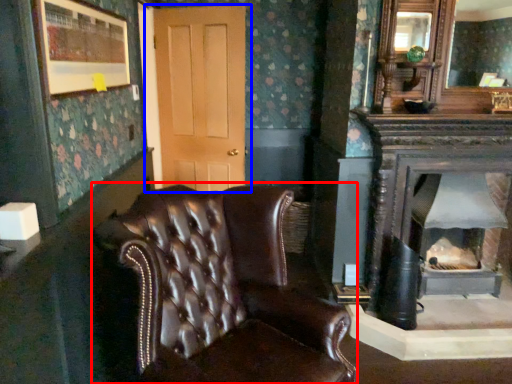
Question: Which object appears closest to the camera in this image, chair (highlighted by a red box) or door (highlighted by a blue box)?

Choices:
 (A) chair
 (B) door

Answer: (A)